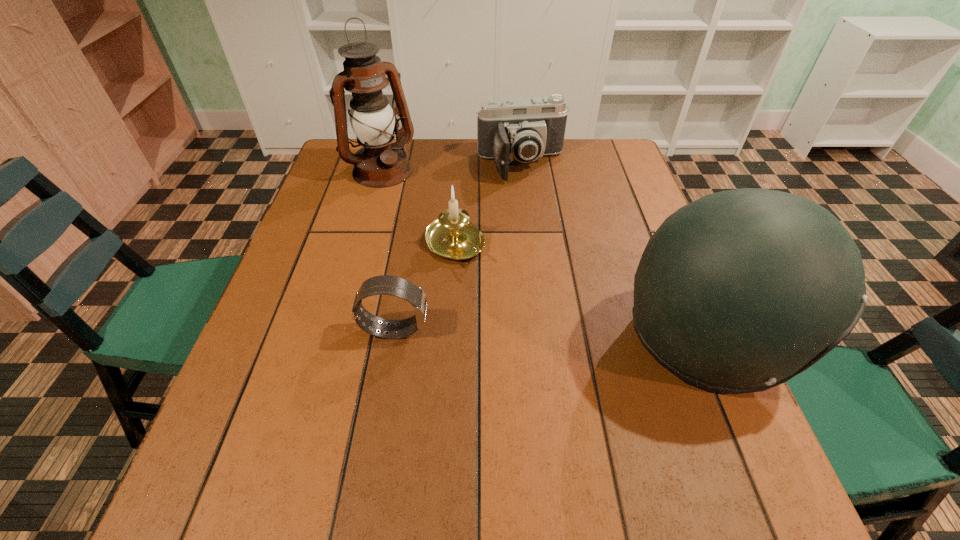
The height and width of the screenshot is (540, 960). What are the coordinates of `vacant point located on the handle side of the third farthest object` in the screenshot? It's located at (489, 281).

Where is `free space located 0.330m on the handle side of the third farthest object`? The image size is (960, 540). free space located 0.330m on the handle side of the third farthest object is located at coordinates (567, 362).

This screenshot has height=540, width=960. Find the location of `vacant region located 0.180m on the handle side of the third farthest object`. vacant region located 0.180m on the handle side of the third farthest object is located at coordinates (519, 313).

Locate an element on the screen. The width and height of the screenshot is (960, 540). free region located at the front of the camera with an open lens cover is located at coordinates (534, 198).

Locate an element on the screen. vacant space located at the front of the camera with an open lens cover is located at coordinates (541, 222).

Locate an element on the screen. vacant space situated 0.140m at the front of the camera with an open lens cover is located at coordinates click(540, 215).

Locate an element on the screen. Image resolution: width=960 pixels, height=540 pixels. lantern at the far edge is located at coordinates [380, 163].

Where is `camera present at the far edge`? This screenshot has height=540, width=960. camera present at the far edge is located at coordinates (523, 129).

Image resolution: width=960 pixels, height=540 pixels. I want to click on object situated at the near edge, so click(x=739, y=291).

The height and width of the screenshot is (540, 960). I want to click on object at the left edge, so click(380, 163).